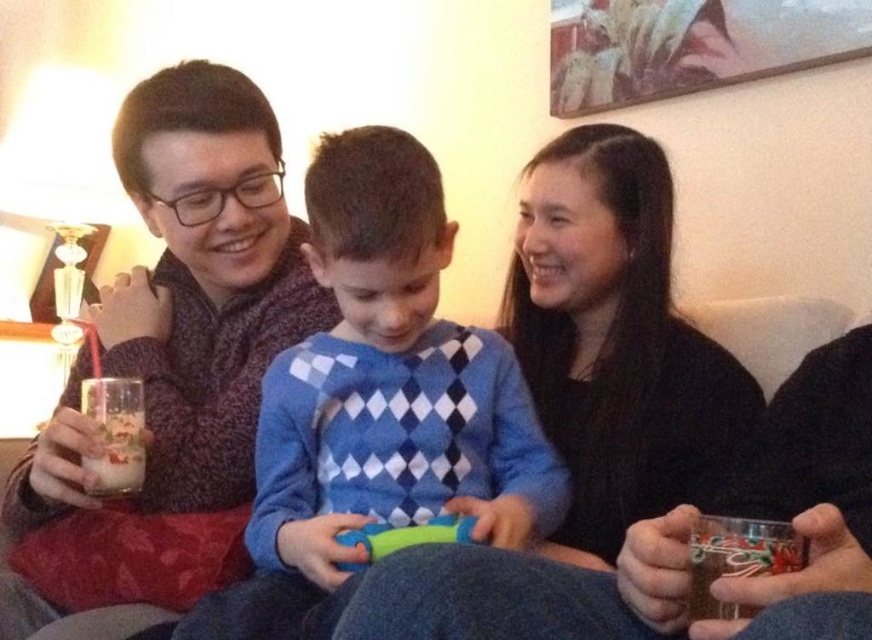
I want to click on matte black sweater at left, so click(x=172, y=356).

Which of these two, matte black sweater at left or milky white glass at left, stands shorter?

milky white glass at left is shorter.

Who is more forward, (x=128, y=513) or (x=127, y=467)?

Positioned in front is point (x=127, y=467).

The width and height of the screenshot is (872, 640). I want to click on matte black sweater at left, so click(x=172, y=356).

Does point (312, 301) come in front of point (393, 548)?

No, (312, 301) is behind (393, 548).

Between matte black sweater at left and green rubber toy at center, which one is positioned higher?

matte black sweater at left is above.

At what (x,y) coordinates should I click in order to perform the action: click on matte black sweater at left. Please return your answer as a coordinate pair (x, y). Looking at the image, I should click on (172, 356).

Is matte black sweater at left closer to the viewer compared to black matte sweater at upper center?

Yes, it is in front of black matte sweater at upper center.

Between point (223, 106) and point (654, 369), which one is positioned in front?

Point (654, 369)

Does point (60, 500) come in front of point (516, 230)?

Yes, it is in front of point (516, 230).

At what (x,y) coordinates should I click in order to perform the action: click on matte black sweater at left. Please return your answer as a coordinate pair (x, y). Image resolution: width=872 pixels, height=640 pixels. Looking at the image, I should click on (172, 356).